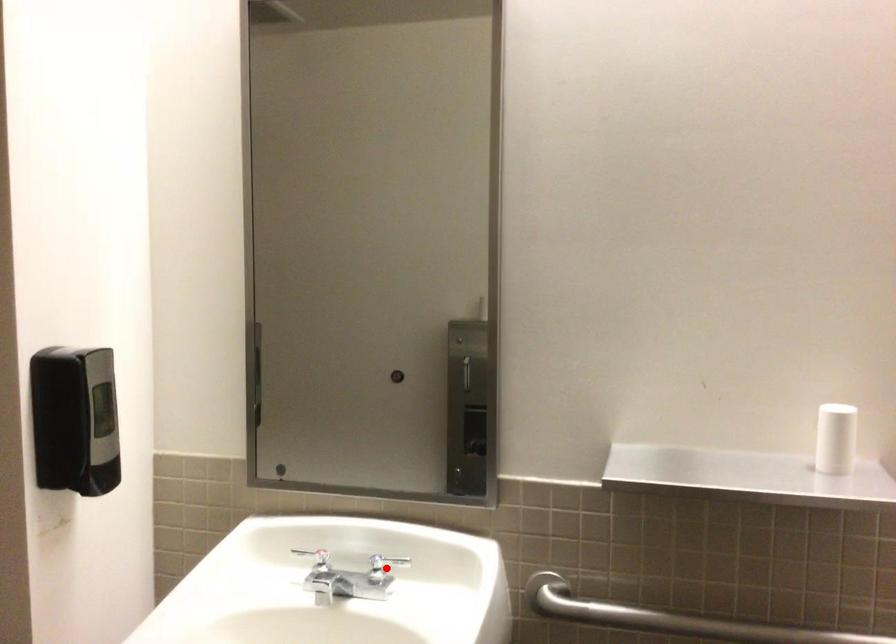
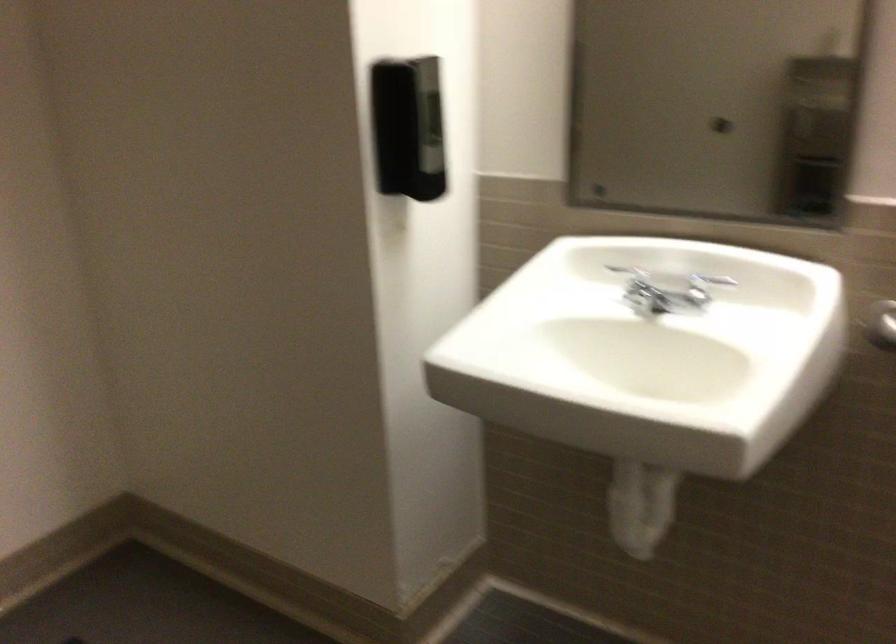
Where in the second image is the point corresponding to the highlighted location from the first image?

(704, 287)